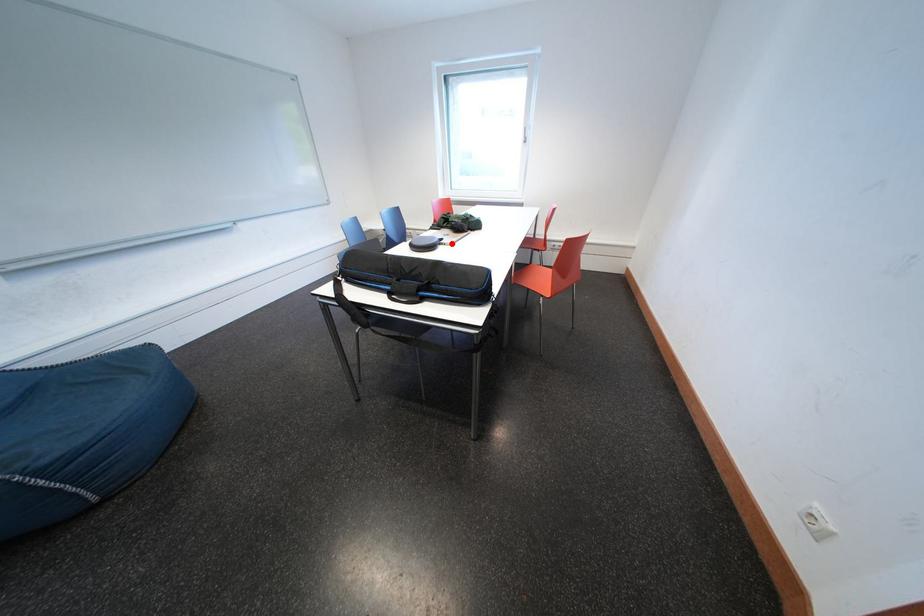
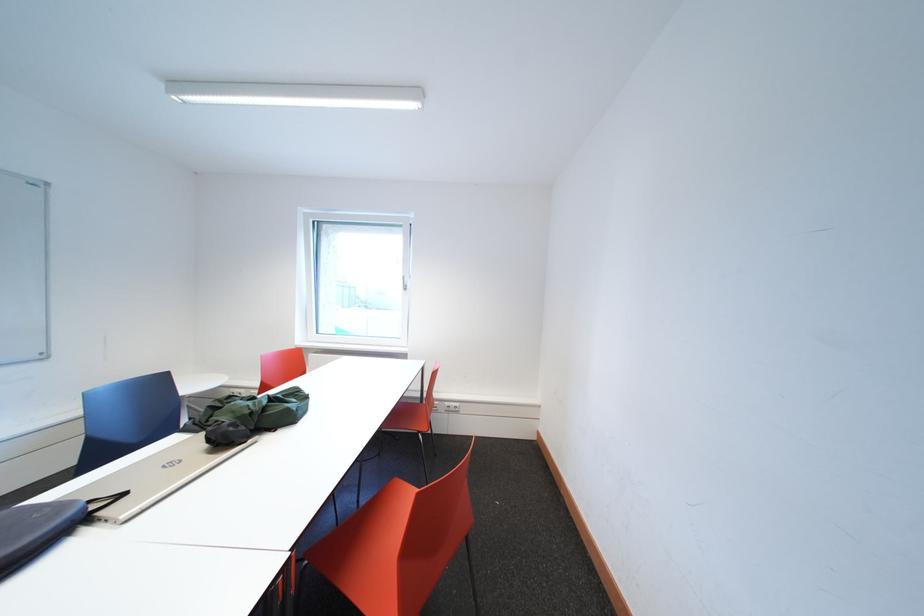
Where in the second image is the point corresponding to the highlighted location from the first image?

(134, 499)